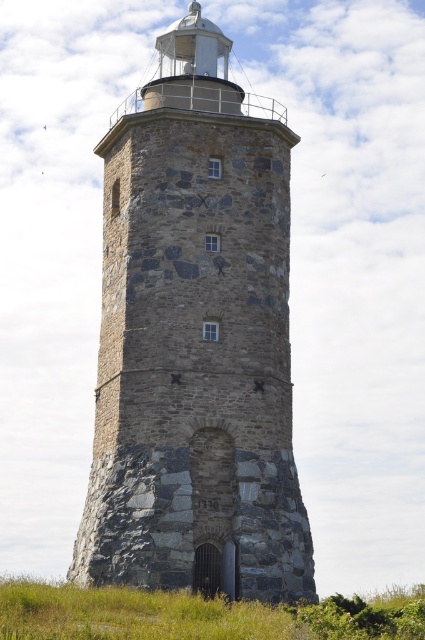
Question: Which of the following is the closest to the observer?

Choices:
 (A) gray stone tower at center
 (B) green grass at lower center

Answer: (B)

Question: From the image, what is the correct spatial relationship of gray stone tower at center in relation to green grass at lower center?

Choices:
 (A) above
 (B) below

Answer: (A)

Question: Does gray stone tower at center have a smaller size compared to green grass at lower center?

Choices:
 (A) no
 (B) yes

Answer: (B)

Question: Can you confirm if gray stone tower at center is bigger than green grass at lower center?

Choices:
 (A) no
 (B) yes

Answer: (A)